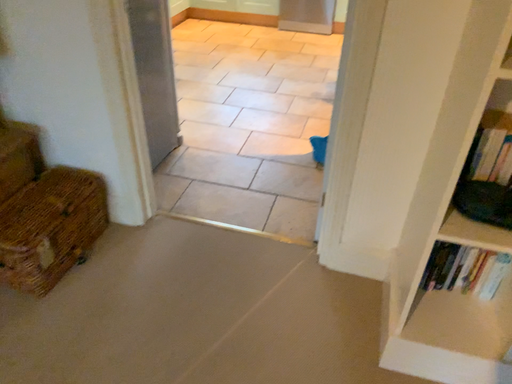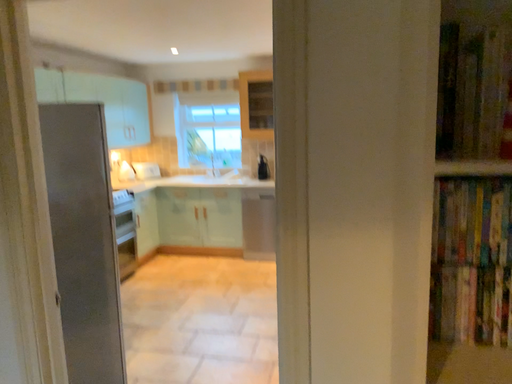
Question: Which way did the camera rotate in the video?

Choices:
 (A) rotated upward
 (B) rotated downward

Answer: (A)